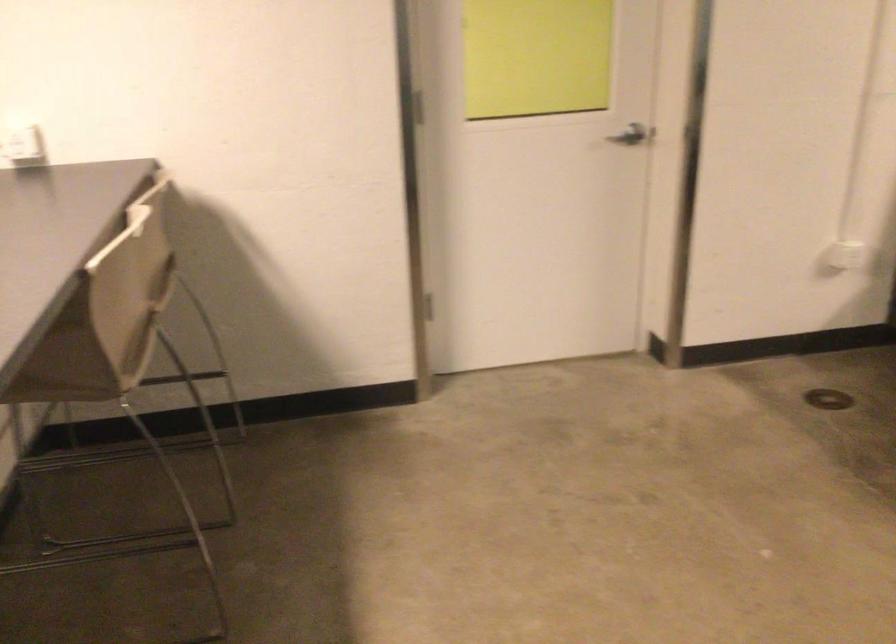
Image resolution: width=896 pixels, height=644 pixels. What are the coordinates of `silver door handle` in the screenshot? It's located at (629, 136).